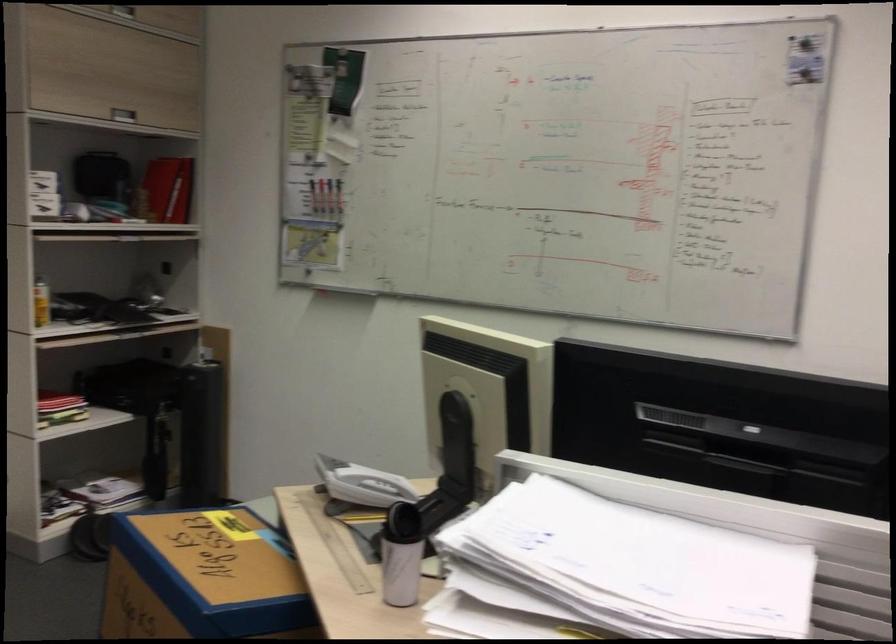
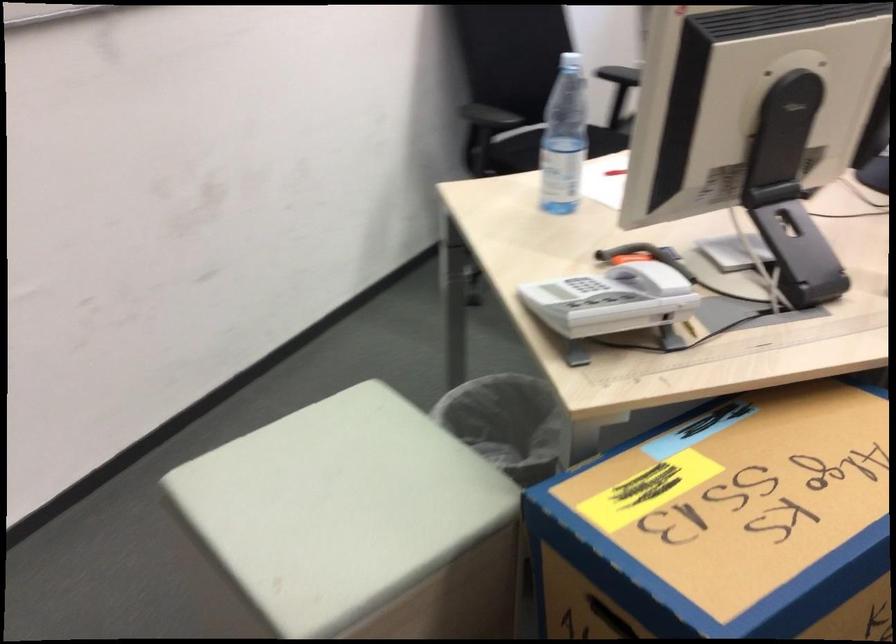
Find the pixel in the second image that matches (347,538) in the first image.

(746, 334)